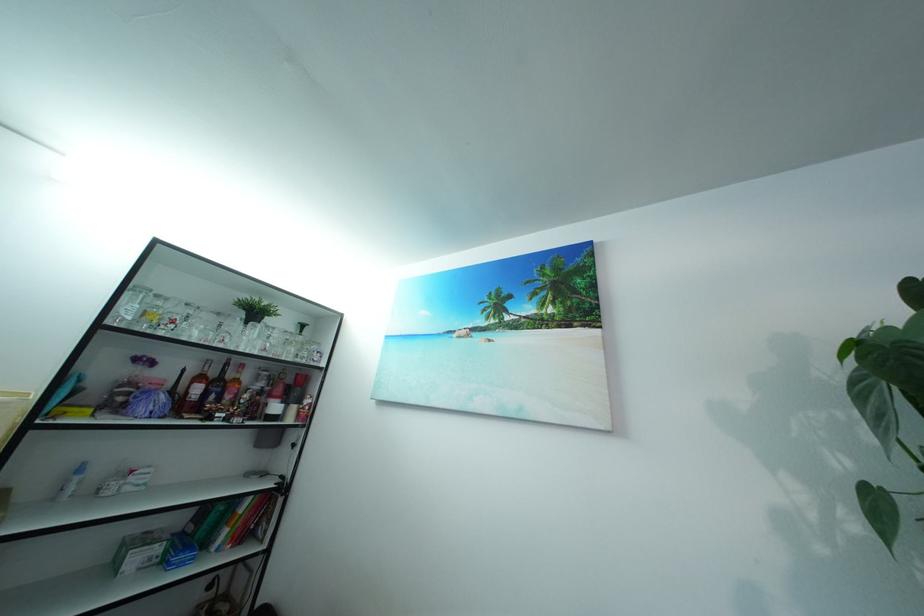
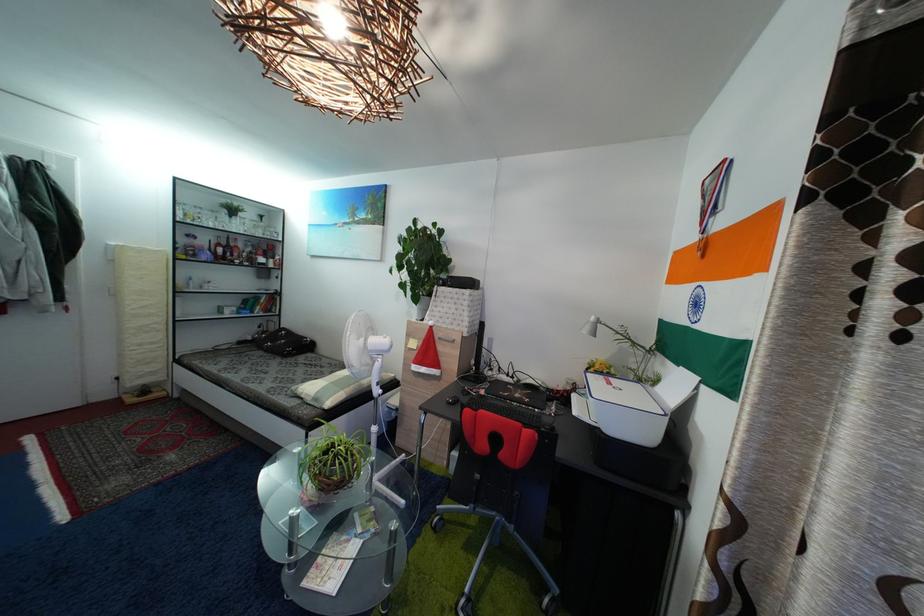
Where in the second image is the point corresponding to [301,336] from the first image?

(264, 225)